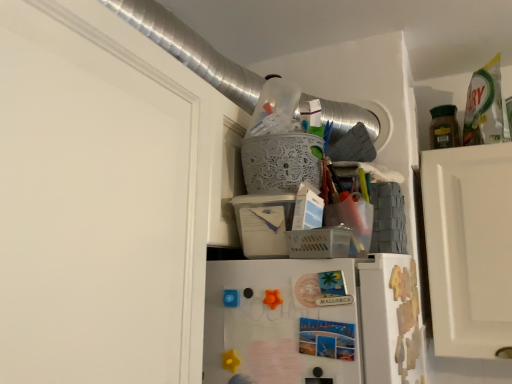
What do you see at coordinates (444, 127) in the screenshot? Image resolution: width=512 pixels, height=384 pixels. I see `green matte jar at upper right` at bounding box center [444, 127].

Describe the element at coordinates (319, 243) in the screenshot. This screenshot has width=512, height=384. I see `plastic/mesh basket at upper center, which is the 2th basket from top to bottom` at that location.

The width and height of the screenshot is (512, 384). I want to click on white lace basket at upper center, which appears as the 1th basket when viewed from the top, so click(281, 162).

Image resolution: width=512 pixels, height=384 pixels. Identify the location of green matte jar at upper right. (444, 127).

Considering the positions of point (301, 139) and point (333, 242), is point (301, 139) closer or farther from the camera than point (333, 242)?

Point (301, 139) is positioned farther from the camera compared to point (333, 242).

Relative to plastic/mesh basket at upper center, which is the first basket in bottom-to-top order, is white lace basket at upper center, acting as the second basket starting from the bottom, in front or behind?

white lace basket at upper center, acting as the second basket starting from the bottom, is behind plastic/mesh basket at upper center, which is the first basket in bottom-to-top order.

Is plastic/mesh basket at upper center, which is the first basket in bottom-to-top order, a part of white lace basket at upper center, acting as the second basket starting from the bottom?

No, plastic/mesh basket at upper center, which is the first basket in bottom-to-top order, is not inside white lace basket at upper center, acting as the second basket starting from the bottom.

Which of these two, plastic/mesh basket at upper center, which is the 2th basket from top to bottom, or green matte jar at upper right, is thinner?

plastic/mesh basket at upper center, which is the 2th basket from top to bottom, is thinner.

This screenshot has width=512, height=384. Find the location of `bottle above the plastic/mesh basket at upper center, which is the first basket in bottom-to-top order (from the image's perspective)`. bottle above the plastic/mesh basket at upper center, which is the first basket in bottom-to-top order (from the image's perspective) is located at coordinates 444,127.

Is plastic/mesh basket at upper center, which is the first basket in bottom-to-top order, touching green matte jar at upper right?

They are not placed beside each other.

From a real-world perspective, is plastic/mesh basket at upper center, which is the first basket in bottom-to-top order, positioned under green matte jar at upper right based on gravity?

Yes.

What's the angular difference between green matte jar at upper right and plastic/mesh basket at upper center, which is the first basket in bottom-to-top order,'s facing directions?

The angle between the facing direction of green matte jar at upper right and the facing direction of plastic/mesh basket at upper center, which is the first basket in bottom-to-top order, is 95.5 degrees.

Does green matte jar at upper right touch plastic/mesh basket at upper center, which is the first basket in bottom-to-top order?

No.

Considering the relative sizes of green matte jar at upper right and plastic/mesh basket at upper center, which is the first basket in bottom-to-top order, in the image provided, is green matte jar at upper right taller than plastic/mesh basket at upper center, which is the first basket in bottom-to-top order,?

Yes, green matte jar at upper right is taller than plastic/mesh basket at upper center, which is the first basket in bottom-to-top order.

From a real-world perspective, between green matte jar at upper right and plastic/mesh basket at upper center, which is the first basket in bottom-to-top order, who is vertically lower?

From a 3D spatial view, plastic/mesh basket at upper center, which is the first basket in bottom-to-top order, is below.

From the picture: In the image, is green matte jar at upper right positioned in front of or behind white lace basket at upper center, which appears as the 1th basket when viewed from the top?

Clearly, green matte jar at upper right is behind white lace basket at upper center, which appears as the 1th basket when viewed from the top.

This screenshot has width=512, height=384. I want to click on the 2nd basket to the left when counting from the green matte jar at upper right, so click(281, 162).

Based on the photo, from a real-world perspective, does green matte jar at upper right stand above white lace basket at upper center, which appears as the 1th basket when viewed from the top?

Indeed, from a real-world perspective, green matte jar at upper right stands above white lace basket at upper center, which appears as the 1th basket when viewed from the top.

Which is less distant, (x=315, y=229) or (x=307, y=134)?

Point (x=315, y=229) is positioned closer to the camera compared to point (x=307, y=134).

From the image's perspective, relative to white lace basket at upper center, which appears as the 1th basket when viewed from the top, is plastic/mesh basket at upper center, which is the 2th basket from top to bottom, above or below?

Clearly, from the image's perspective, plastic/mesh basket at upper center, which is the 2th basket from top to bottom, is below white lace basket at upper center, which appears as the 1th basket when viewed from the top.

Could white lace basket at upper center, which appears as the 1th basket when viewed from the top, be considered to be inside plastic/mesh basket at upper center, which is the first basket in bottom-to-top order?

No, white lace basket at upper center, which appears as the 1th basket when viewed from the top, is not inside plastic/mesh basket at upper center, which is the first basket in bottom-to-top order.

Considering the sizes of objects plastic/mesh basket at upper center, which is the first basket in bottom-to-top order, and white lace basket at upper center, acting as the second basket starting from the bottom, in the image provided, who is thinner, plastic/mesh basket at upper center, which is the first basket in bottom-to-top order, or white lace basket at upper center, acting as the second basket starting from the bottom,?

Thinner between the two is plastic/mesh basket at upper center, which is the first basket in bottom-to-top order.

Does white lace basket at upper center, acting as the second basket starting from the bottom, appear on the right side of green matte jar at upper right?

No, white lace basket at upper center, acting as the second basket starting from the bottom, is not to the right of green matte jar at upper right.

Are white lace basket at upper center, acting as the second basket starting from the bottom, and green matte jar at upper right beside each other?

No.

The width and height of the screenshot is (512, 384). Identify the location of bottle on the right of white lace basket at upper center, acting as the second basket starting from the bottom. (444, 127).

Between white lace basket at upper center, which appears as the 1th basket when viewed from the top, and green matte jar at upper right, which one has smaller width?

Thinner between the two is green matte jar at upper right.

Locate an element on the screen. The height and width of the screenshot is (384, 512). basket located above the plastic/mesh basket at upper center, which is the 2th basket from top to bottom (from a real-world perspective) is located at coordinates (281, 162).

In order to click on the 1st basket to the left of the green matte jar at upper right, counting from the anchor's position in this screenshot , I will do `click(319, 243)`.

Estimate the real-world distances between objects in this image. Which object is further from white lace basket at upper center, acting as the second basket starting from the bottom, plastic/mesh basket at upper center, which is the 2th basket from top to bottom, or green matte jar at upper right?

Among the two, green matte jar at upper right is located further to white lace basket at upper center, acting as the second basket starting from the bottom.

When comparing their distances from plastic/mesh basket at upper center, which is the 2th basket from top to bottom, does white lace basket at upper center, acting as the second basket starting from the bottom, or green matte jar at upper right seem further?

green matte jar at upper right lies further to plastic/mesh basket at upper center, which is the 2th basket from top to bottom, than the other object.

Estimate the real-world distances between objects in this image. Which object is further from plastic/mesh basket at upper center, which is the 2th basket from top to bottom, green matte jar at upper right or white lace basket at upper center, which appears as the 1th basket when viewed from the top?

Among the two, green matte jar at upper right is located further to plastic/mesh basket at upper center, which is the 2th basket from top to bottom.

Considering their positions, is plastic/mesh basket at upper center, which is the first basket in bottom-to-top order, positioned closer to green matte jar at upper right than white lace basket at upper center, which appears as the 1th basket when viewed from the top?

white lace basket at upper center, which appears as the 1th basket when viewed from the top.

When comparing their distances from white lace basket at upper center, acting as the second basket starting from the bottom, does green matte jar at upper right or plastic/mesh basket at upper center, which is the first basket in bottom-to-top order, seem further?

green matte jar at upper right.

Based on their spatial positions, is white lace basket at upper center, acting as the second basket starting from the bottom, or plastic/mesh basket at upper center, which is the 2th basket from top to bottom, further from green matte jar at upper right?

plastic/mesh basket at upper center, which is the 2th basket from top to bottom.

Find the location of `basket between plastic/mesh basket at upper center, which is the first basket in bottom-to-top order, and green matte jar at upper right, along the z-axis`. basket between plastic/mesh basket at upper center, which is the first basket in bottom-to-top order, and green matte jar at upper right, along the z-axis is located at coordinates (281, 162).